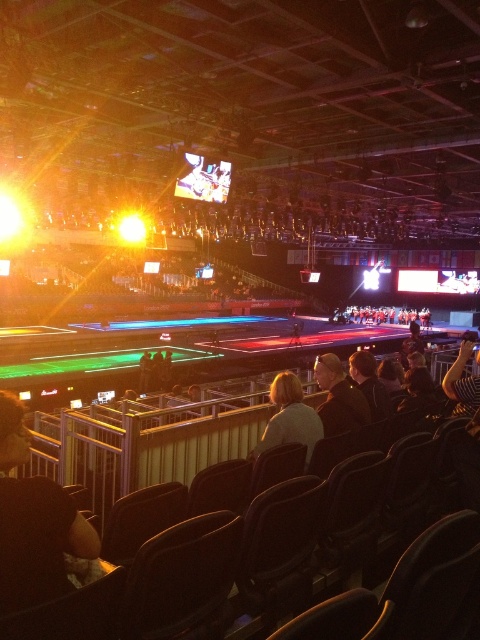
Question: Which of the following is the farthest from the observer?

Choices:
 (A) black leather jacket at center
 (B) light brown leather jacket at center

Answer: (A)

Question: Which object is closer to the camera taking this photo?

Choices:
 (A) dark brown leather jacket at lower left
 (B) light brown leather jacket at center

Answer: (A)

Question: Does dark brown leather jacket at lower left have a greater width compared to light brown leather jacket at center?

Choices:
 (A) yes
 (B) no

Answer: (B)

Question: Which of the following is the closest to the observer?

Choices:
 (A) pos(340,400)
 (B) pos(284,385)
 (C) pos(1,428)

Answer: (C)

Question: Does dark brown leather jacket at lower left appear over black leather jacket at center?

Choices:
 (A) no
 (B) yes

Answer: (B)

Question: Observing the image, what is the correct spatial positioning of dark brown leather jacket at lower left in reference to light brown leather jacket at center?

Choices:
 (A) left
 (B) right

Answer: (A)